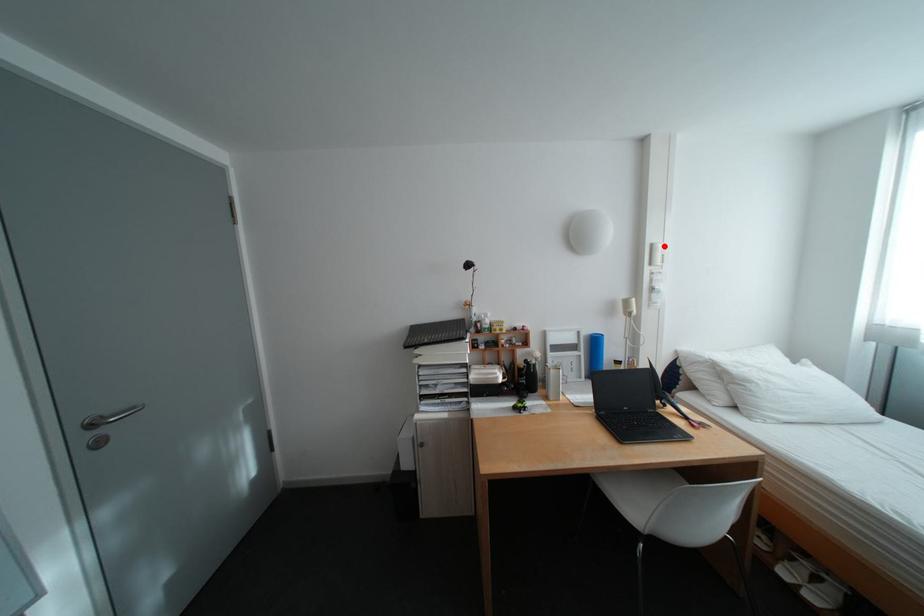
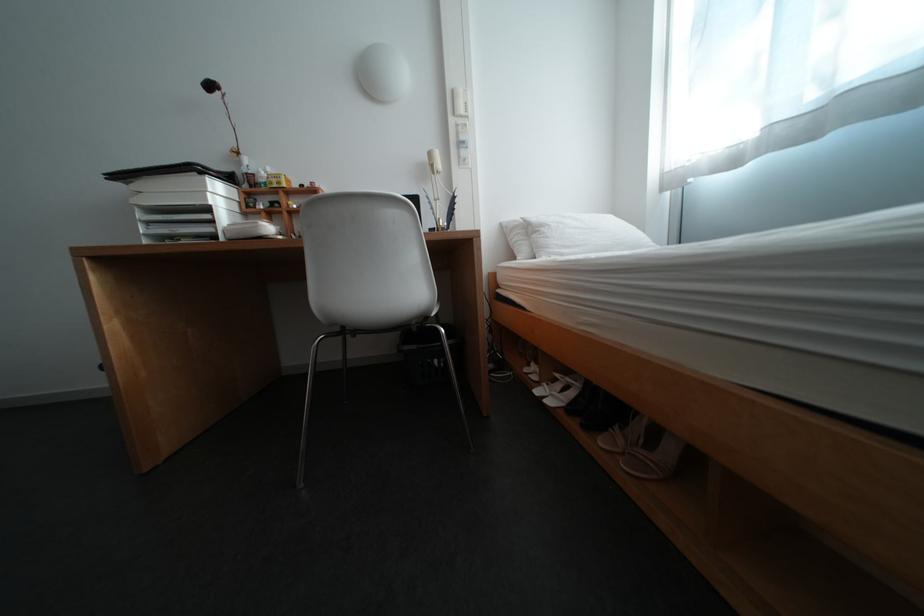
Question: I am providing you with two images of the same scene from different viewpoints. A red point is marked on the first image. At the location where the point appears in image 1, is it still visible in image 2?

Choices:
 (A) Yes
 (B) No

Answer: (A)